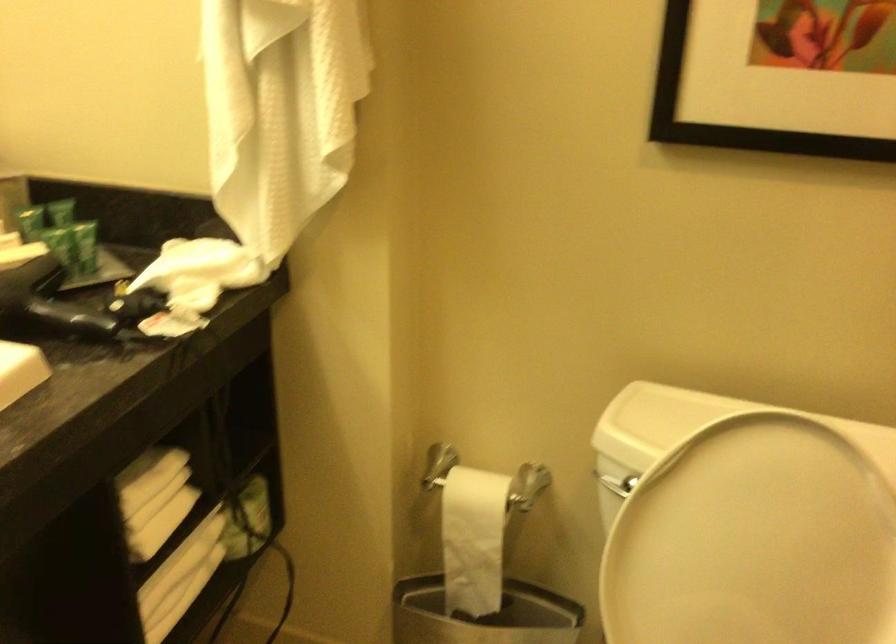
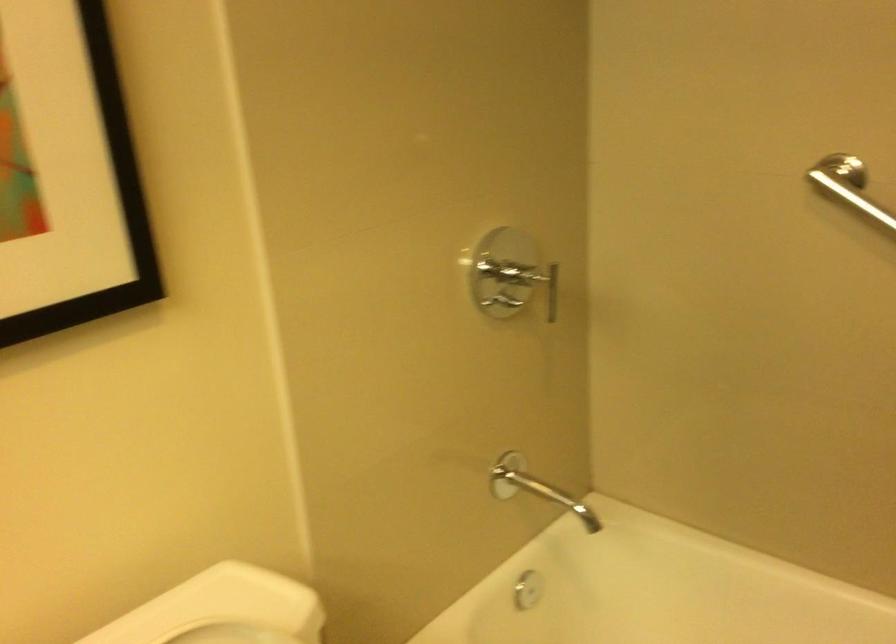
Question: The camera is either moving clockwise (left) or counter-clockwise (right) around the object. The first image is from the beginning of the video and the second image is from the end. Is the camera moving left or right when shooting the video?

Choices:
 (A) Left
 (B) Right

Answer: (A)